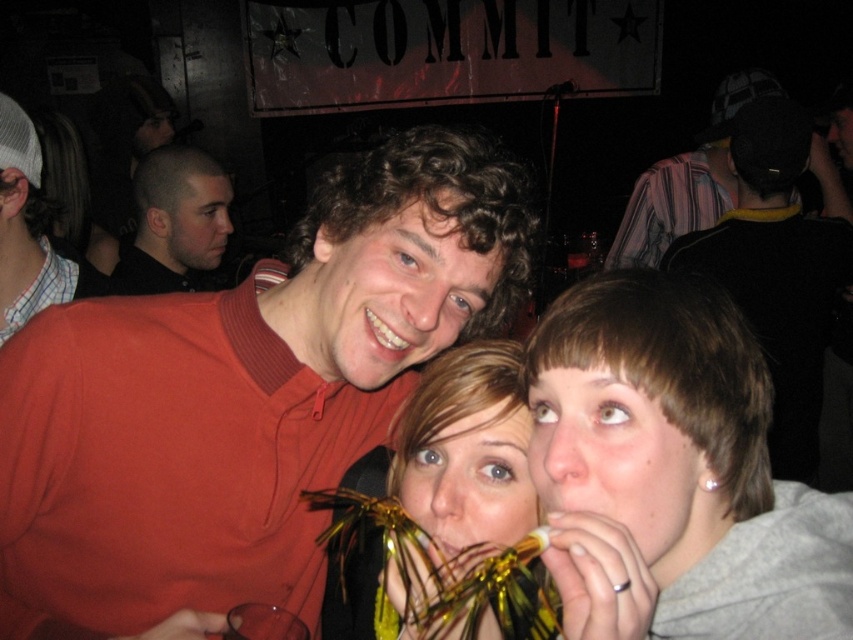
You are at a party and want to get the attention of the person wearing the shiny black shirt at left. Since you are standing behind the striped fabric shirt at upper right, can you easily see them to wave?

The shiny black shirt at left is to the left of striped fabric shirt at upper right, so you are standing behind the striped fabric shirt at upper right which is to the right of the shiny black shirt at left. Therefore, you can easily see them to wave since they are to your left side.

In the scene shown: You are standing in the social scene and want to take a photo of the three people. The camera you have can only focus on objects within 7 feet. Is the point at coordinates point (165, 216) within the camera focus range?

The distance of point (165, 216) from camera is 7.60 feet, which is beyond the camera focus range of 7 feet. Therefore, the point at coordinates point (165, 216) is outside the camera focus range.

You are at a party and want to give a gift wrapped in shiny gold foil at center to someone wearing the striped fabric shirt at upper right. Can you determine if the gift will fit in their shirt pocket?

The shiny gold foil at center is smaller than the striped fabric shirt at upper right, so the gift can fit in their shirt pocket.